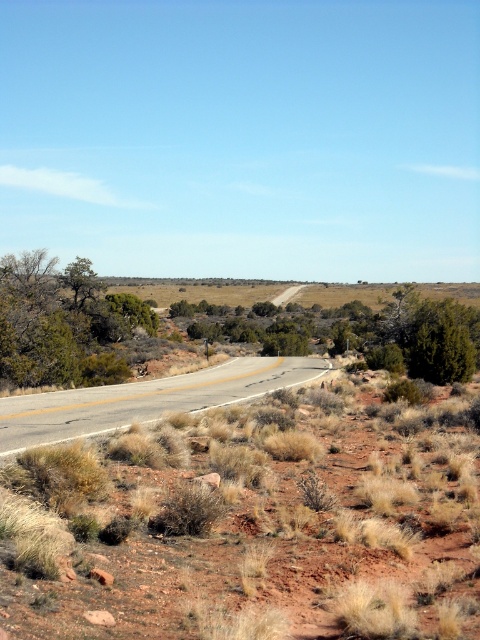
Question: Which point is closer to the camera?

Choices:
 (A) green shrubbery at center
 (B) asphalt road at center
 (C) dry grass at center

Answer: (C)

Question: Is green shrubbery at center thinner than asphalt road at center?

Choices:
 (A) no
 (B) yes

Answer: (A)

Question: Does dry grass at center have a lesser width compared to asphalt road at center?

Choices:
 (A) no
 (B) yes

Answer: (A)

Question: Does dry grass at center appear under asphalt road at center?

Choices:
 (A) no
 (B) yes

Answer: (A)

Question: Based on their relative distances, which object is nearer to the dry grass at center?

Choices:
 (A) asphalt road at center
 (B) green shrubbery at center

Answer: (A)

Question: Among these objects, which one is nearest to the camera?

Choices:
 (A) dry grass at center
 (B) asphalt road at center

Answer: (A)